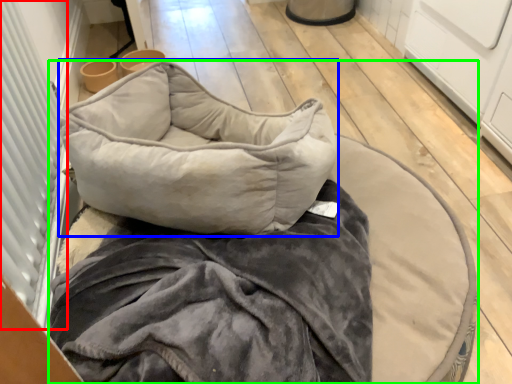
Question: Estimate the real-world distances between objects in this image. Which object is closer to screen door (highlighted by a red box), pillow (highlighted by a blue box) or furniture (highlighted by a green box)?

Choices:
 (A) pillow
 (B) furniture

Answer: (A)